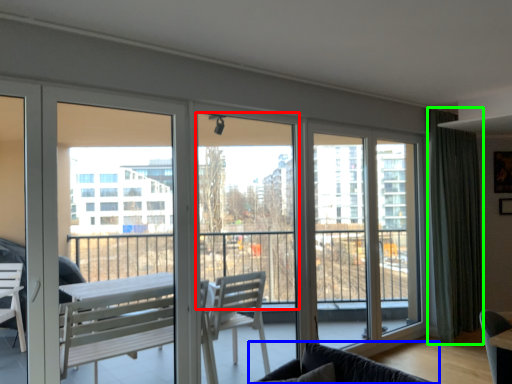
Question: Which is nearer to the window screen (highlighted by a red box)? studio couch (highlighted by a blue box) or curtain (highlighted by a green box).

Choices:
 (A) studio couch
 (B) curtain

Answer: (A)